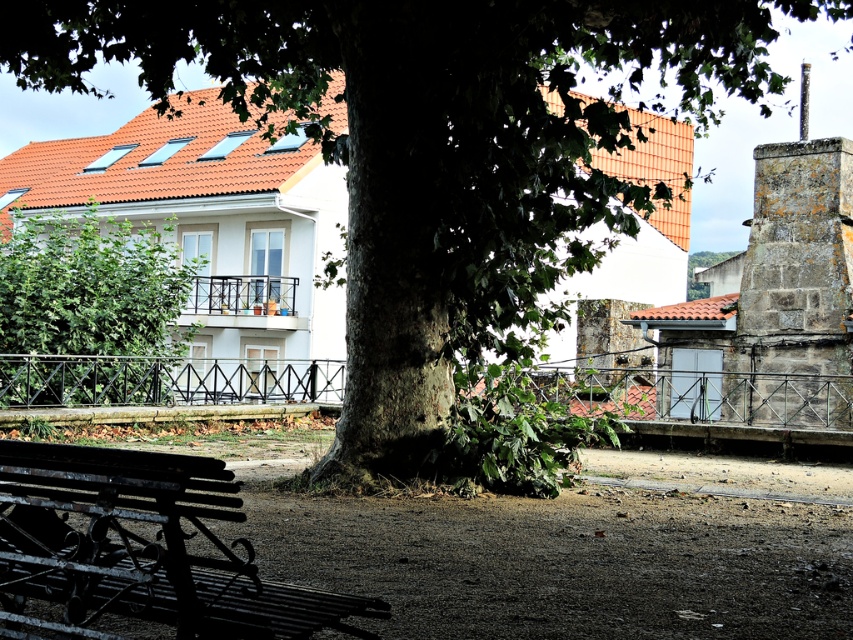
Question: Among these points, which one is farthest from the camera?

Choices:
 (A) (805, 355)
 (B) (119, 397)
 (C) (4, 586)

Answer: (A)

Question: Which object is farther from the camera taking this photo?

Choices:
 (A) gray stone chimney at upper right
 (B) green leafy tree at left

Answer: (A)

Question: Is rusty metal bench at lower left wider than gray stone chimney at upper right?

Choices:
 (A) yes
 (B) no

Answer: (A)

Question: Is the position of rusty metal bench at lower left less distant than that of green leafy tree at left?

Choices:
 (A) no
 (B) yes

Answer: (B)

Question: Which point appears closest to the camera in this image?

Choices:
 (A) (175, 465)
 (B) (782, 227)

Answer: (A)

Question: From the image, what is the correct spatial relationship of rusty metal bench at lower left in relation to gray stone chimney at upper right?

Choices:
 (A) left
 (B) right

Answer: (A)